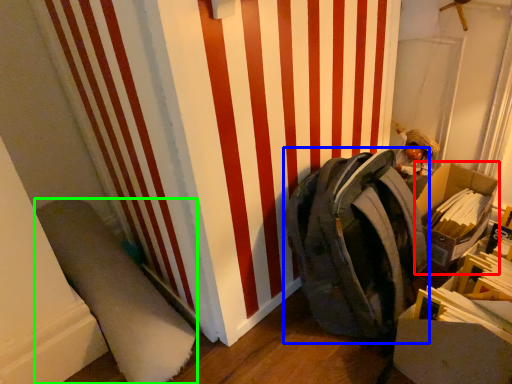
Question: Considering the real-world distances, which object is closest to cardboard box (highlighted by a red box)? backpack (highlighted by a blue box) or wide (highlighted by a green box).

Choices:
 (A) backpack
 (B) wide

Answer: (A)